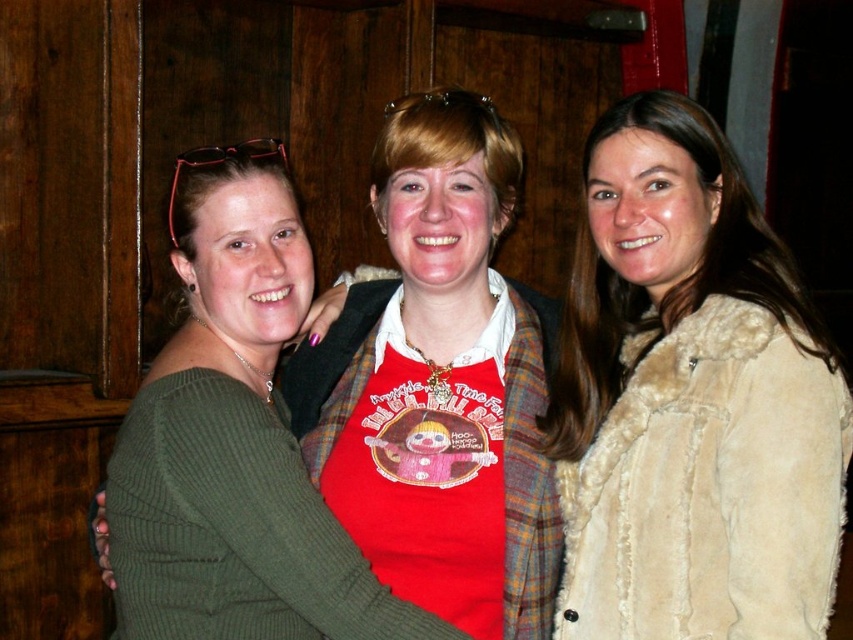
Question: Which point is closer to the camera taking this photo?

Choices:
 (A) (592, 273)
 (B) (741, 554)

Answer: (B)

Question: Considering the relative positions of red matte apron at center and beige fur coat at right in the image provided, where is red matte apron at center located with respect to beige fur coat at right?

Choices:
 (A) right
 (B) left

Answer: (B)

Question: Based on their relative distances, which object is nearer to the beige fur coat at right?

Choices:
 (A) red matte apron at center
 (B) beige furry coat at right

Answer: (B)

Question: Can you confirm if red matte apron at center is bigger than beige fur coat at right?

Choices:
 (A) no
 (B) yes

Answer: (B)

Question: Which of the following is the closest to the observer?

Choices:
 (A) (635, 326)
 (B) (473, 116)
 (C) (672, 401)

Answer: (C)

Question: Does red matte apron at center have a lesser width compared to beige fur coat at right?

Choices:
 (A) yes
 (B) no

Answer: (B)